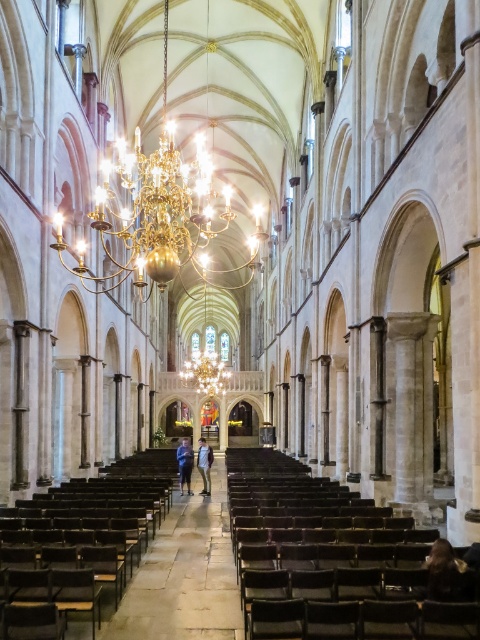
Question: Which point is closer to the camera?

Choices:
 (A) (272, 592)
 (B) (180, 449)
 (C) (201, 390)

Answer: (A)

Question: Does gold metallic chandelier at center come behind blue denim jeans at center?

Choices:
 (A) no
 (B) yes

Answer: (B)

Question: Can you confirm if gold metallic chandelier at upper center is smaller than gold metallic chandelier at center?

Choices:
 (A) no
 (B) yes

Answer: (A)

Question: Which object is the closest to the light blue denim jeans at center?

Choices:
 (A) gold metallic chandelier at center
 (B) dark brown leather chair at lower left

Answer: (B)

Question: Can you confirm if brown wooden aisle at center is smaller than light blue denim jeans at center?

Choices:
 (A) yes
 (B) no

Answer: (A)

Question: Which object is farther from the camera taking this photo?

Choices:
 (A) light blue denim jeans at center
 (B) gold metallic chandelier at upper center
 (C) gold metallic chandelier at center
 (D) dark brown leather chair at lower left

Answer: (C)